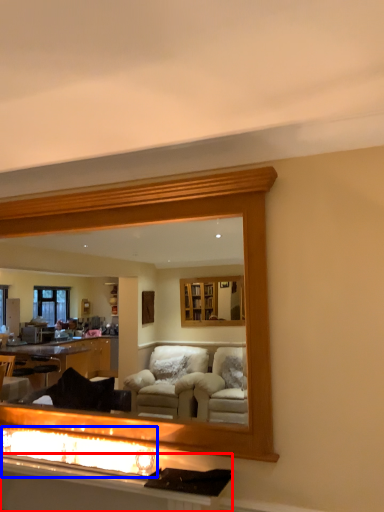
Question: Which point is closer to the camera, vanity (highlighted by a red box) or reflection (highlighted by a blue box)?

Choices:
 (A) vanity
 (B) reflection

Answer: (A)